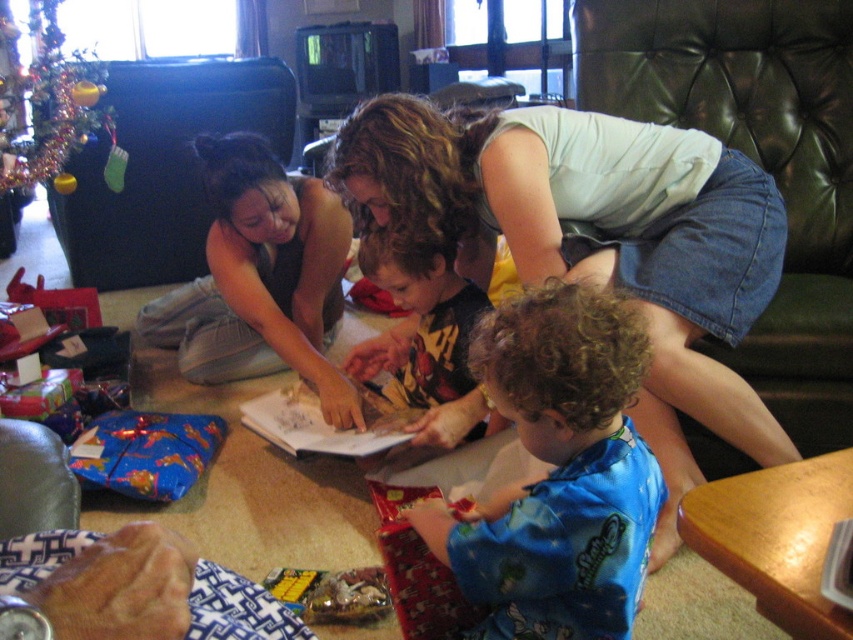
You are a guest at the holiday gathering and need to choose an outfit to wear for the evening. Which item of clothing is larger in size between the denim skirt at center and the blue satin pajamas at lower center?

The denim skirt at center is larger than the blue satin pajamas at lower center.

You are a photographer setting up for a group photo. You notice the denim skirt at center and the yellow printed shirt at center. Which clothing item should you position to the left to ensure they are aligned properly?

The yellow printed shirt at center should be positioned to the left since the denim skirt at center is currently to the right of it.

You are a delivery person who needs to place a small package between the denim skirt at center and the blue satin pajamas at lower center. The package is 20 inches long. Can you fit it between them without moving either item?

The denim skirt at center is 18.91 inches away from blue satin pajamas at lower center. Since the package is 20 inches long, it cannot fit between them without moving either item because the distance is shorter than the package length.